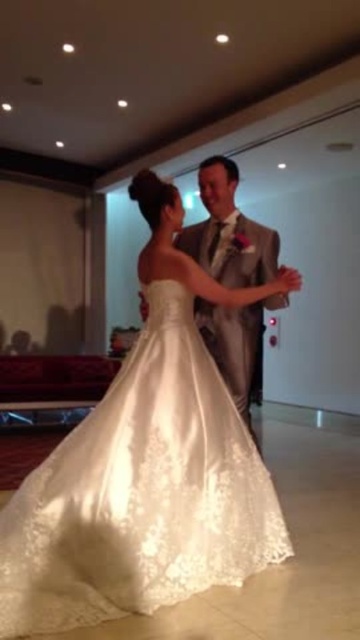
Question: Which of the following is the farthest from the observer?

Choices:
 (A) (246, 364)
 (B) (64, 440)

Answer: (B)

Question: Considering the relative positions of ivory satin dress at center and satin/velvet suit at center in the image provided, where is ivory satin dress at center located with respect to satin/velvet suit at center?

Choices:
 (A) right
 (B) left

Answer: (B)

Question: Observing the image, what is the correct spatial positioning of ivory satin dress at center in reference to satin/velvet suit at center?

Choices:
 (A) below
 (B) above

Answer: (A)

Question: Can you confirm if ivory satin dress at center is thinner than satin/velvet suit at center?

Choices:
 (A) no
 (B) yes

Answer: (A)

Question: Which object appears farthest from the camera in this image?

Choices:
 (A) ivory satin dress at center
 (B) satin/velvet suit at center

Answer: (B)